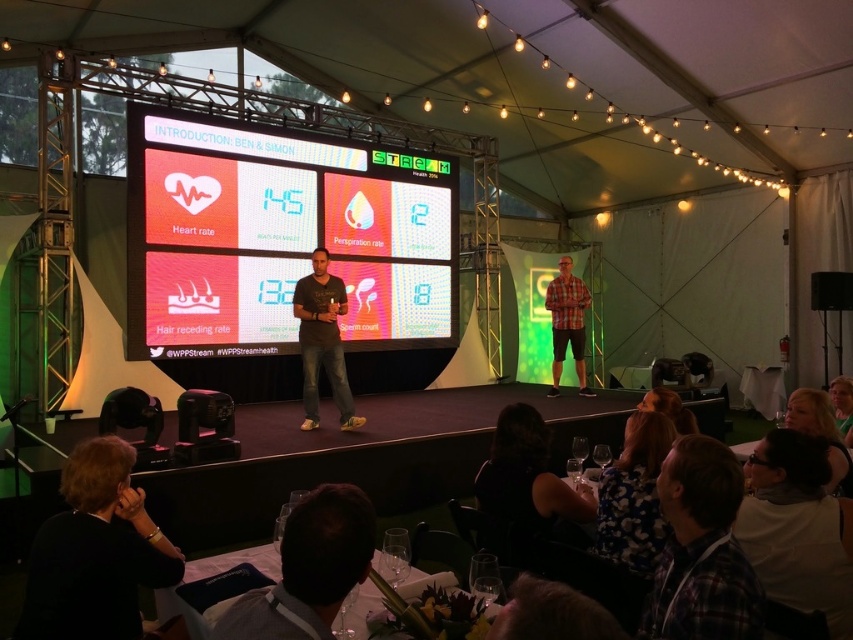
Question: Among these points, which one is nearest to the camera?

Choices:
 (A) (602, 480)
 (B) (735, 483)
 (C) (438, 330)

Answer: (B)

Question: Which of the following is the closest to the observer?

Choices:
 (A) (614, 524)
 (B) (772, 596)
 (C) (331, 520)

Answer: (C)

Question: Does dark brown hair at lower center lie behind floral fabric dress at lower center?

Choices:
 (A) yes
 (B) no

Answer: (B)

Question: Can you confirm if black fabric at lower left is bigger than white fabric at lower right?

Choices:
 (A) yes
 (B) no

Answer: (B)

Question: Is black fabric at lower center below blonde hair at lower center?

Choices:
 (A) no
 (B) yes

Answer: (B)

Question: Among these objects, which one is nearest to the camera?

Choices:
 (A) white fabric at lower right
 (B) floral fabric dress at lower center

Answer: (A)